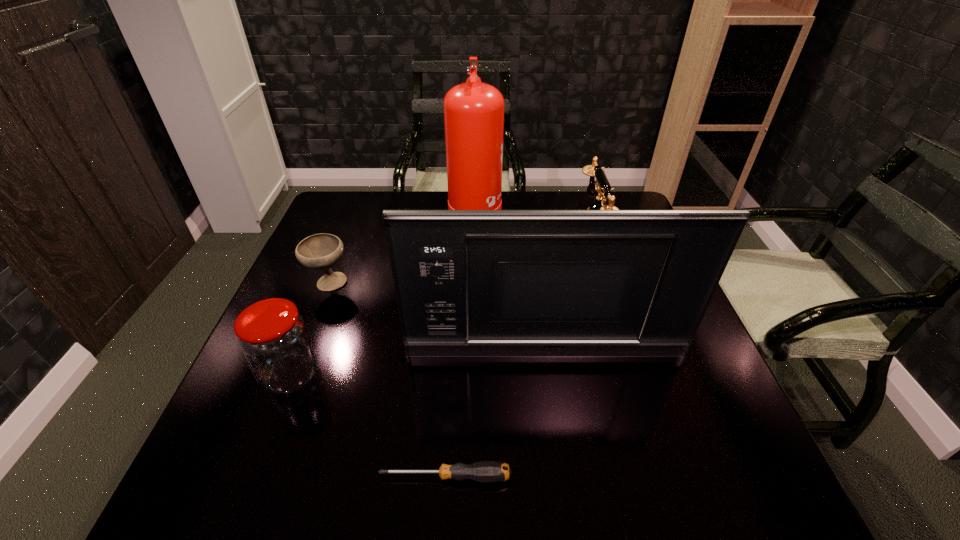
What are the coordinates of `chalice present at the left edge` in the screenshot? It's located at pos(321,251).

The image size is (960, 540). In order to click on microwave oven located at the right edge in this screenshot , I will do `click(468, 282)`.

This screenshot has height=540, width=960. I want to click on telephone at the right edge, so click(602, 186).

I want to click on object at the far right corner, so click(x=602, y=186).

Locate an element on the screen. This screenshot has height=540, width=960. vacant region at the far edge is located at coordinates (541, 198).

This screenshot has height=540, width=960. In the image, there is a desktop. What are the coordinates of `blank space at the near edge` in the screenshot? It's located at (542, 490).

The width and height of the screenshot is (960, 540). What are the coordinates of `free space at the left edge of the desktop` in the screenshot? It's located at [x=361, y=238].

The height and width of the screenshot is (540, 960). I want to click on vacant region at the right edge, so click(x=681, y=365).

The width and height of the screenshot is (960, 540). In order to click on vacant space at the far left corner of the desktop in this screenshot , I will do `click(362, 195)`.

Where is `vacant region between the shortest object and the microwave oven`? vacant region between the shortest object and the microwave oven is located at coordinates (495, 416).